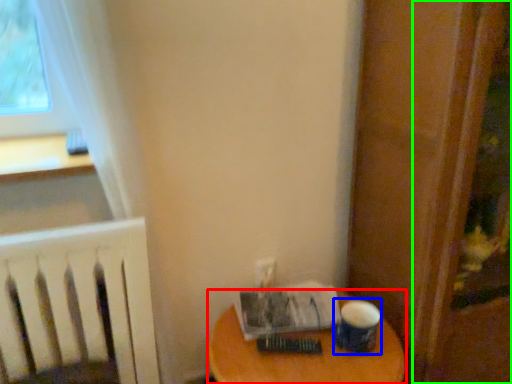
Question: Considering the real-world distances, which object is farthest from table (highlighted by a red box)? paper cup (highlighted by a blue box) or screen door (highlighted by a green box)?

Choices:
 (A) paper cup
 (B) screen door

Answer: (B)